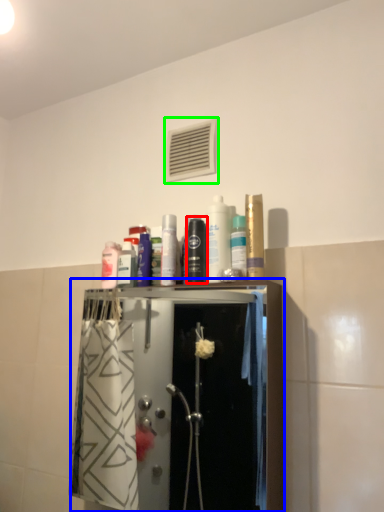
Question: Based on their relative distances, which object is farther from mouthwash (highlighted by a red box)? Choose from closet (highlighted by a blue box) and air conditioning (highlighted by a green box).

Choices:
 (A) closet
 (B) air conditioning

Answer: (A)